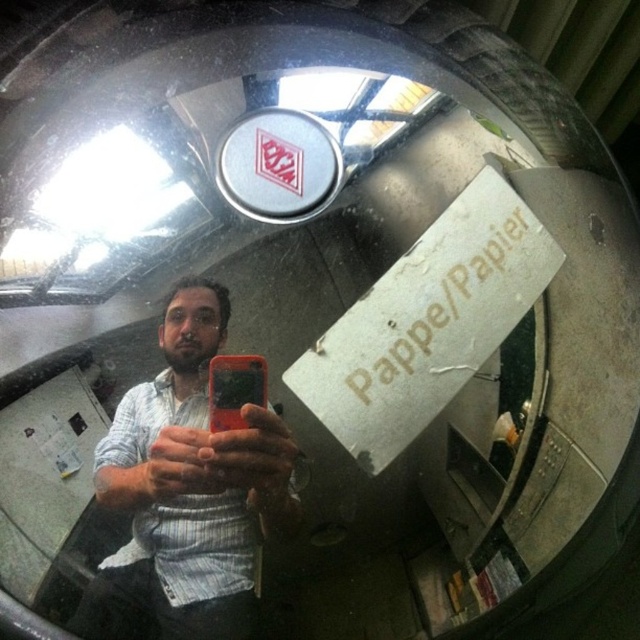
Question: Which of the following is the closest to the observer?

Choices:
 (A) (216, 358)
 (B) (176, 572)

Answer: (A)

Question: Does white striped shirt at center have a lesser width compared to orange matte smartphone at center?

Choices:
 (A) yes
 (B) no

Answer: (B)

Question: Which of the following is the farthest from the observer?

Choices:
 (A) (145, 410)
 (B) (228, 392)

Answer: (A)

Question: Does white striped shirt at center have a greater width compared to orange matte smartphone at center?

Choices:
 (A) no
 (B) yes

Answer: (B)

Question: Where is white striped shirt at center located in relation to orange matte smartphone at center in the image?

Choices:
 (A) below
 (B) above

Answer: (A)